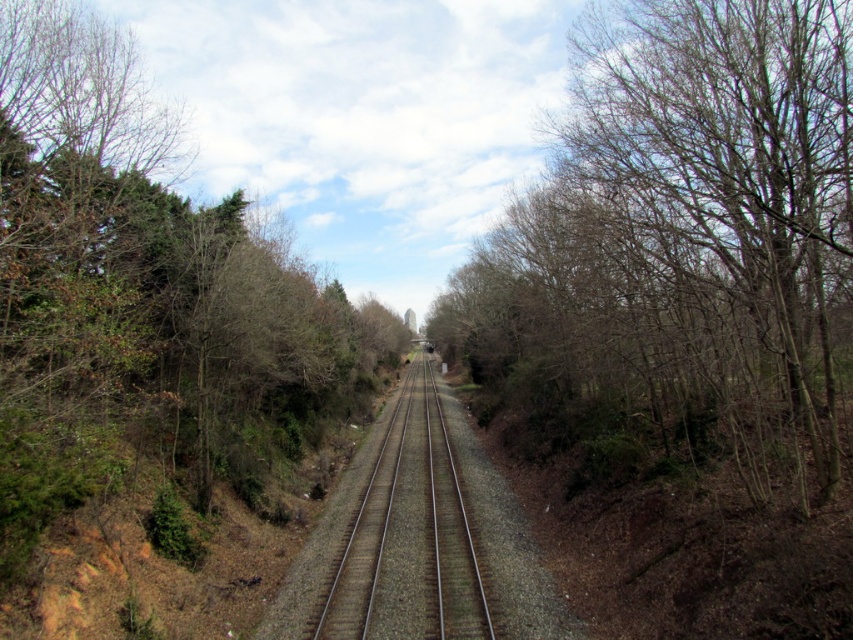
You are a bird flying over the railway track. You see the bare branches at center and the metal train track at center. Which one is taller?

The bare branches at center is taller than the metal train track at center.

Looking at this image, you are standing at the starting point of the railway track and want to walk towards the distant horizon. Which of the two points, point [781,259] or point [427,593], would you encounter first along your path?

You would encounter point [781,259] first because it is closer to the viewer than point [427,593].